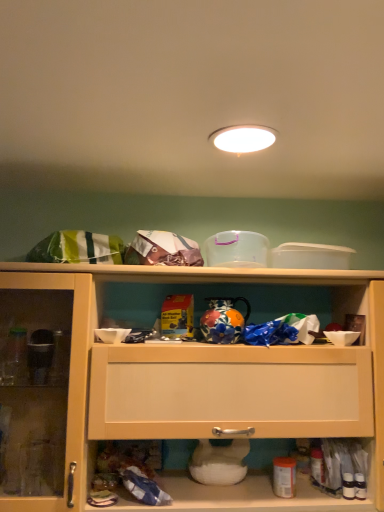
This screenshot has height=512, width=384. Identify the location of free space above white glossy light fixture at upper center (from a real-world perspective). (243, 136).